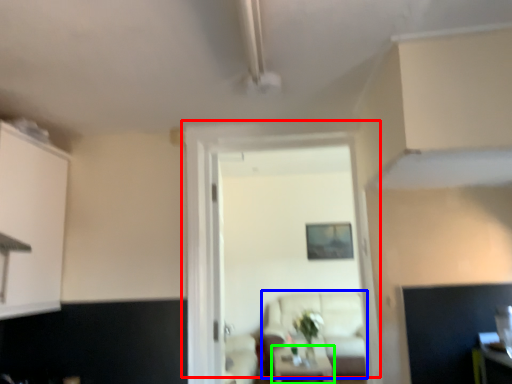
Question: Considering the real-world distances, which object is closest to door (highlighted by a red box)? couch (highlighted by a blue box) or table (highlighted by a green box).

Choices:
 (A) couch
 (B) table

Answer: (B)